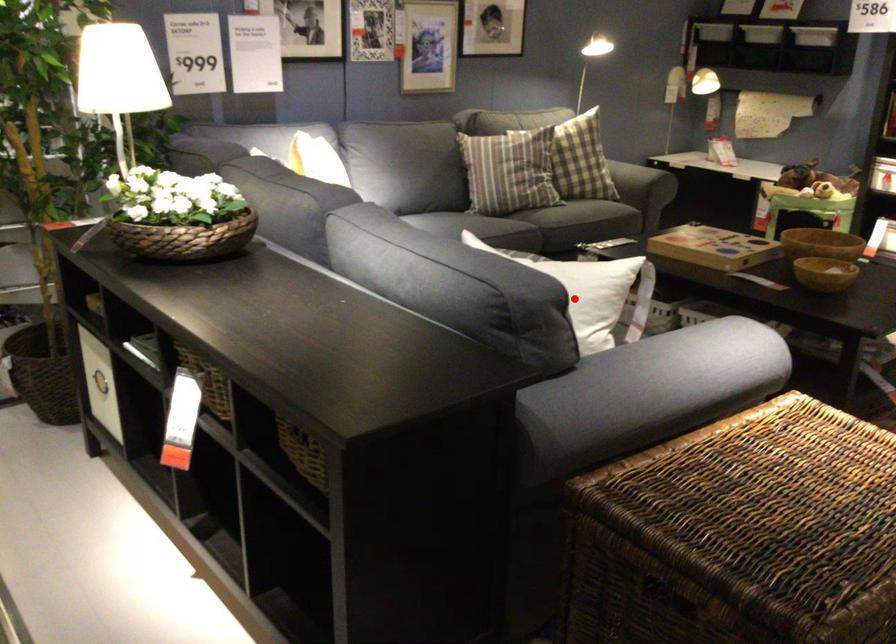
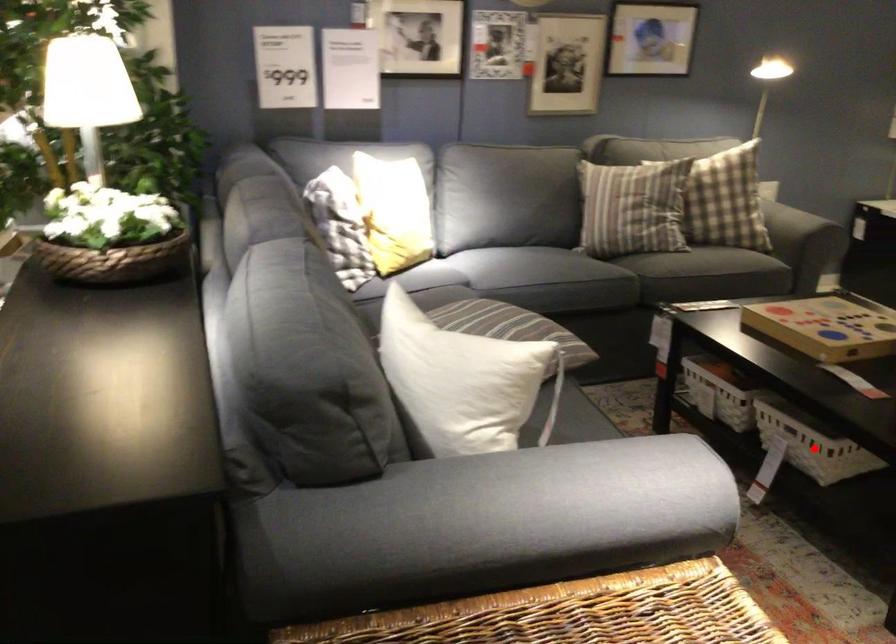
I am providing you with two images of the same scene from different viewpoints. A red point is marked on the first image and another point is marked on the second image. Does the point marked in image1 correspond to the same location as the one in image2?

No